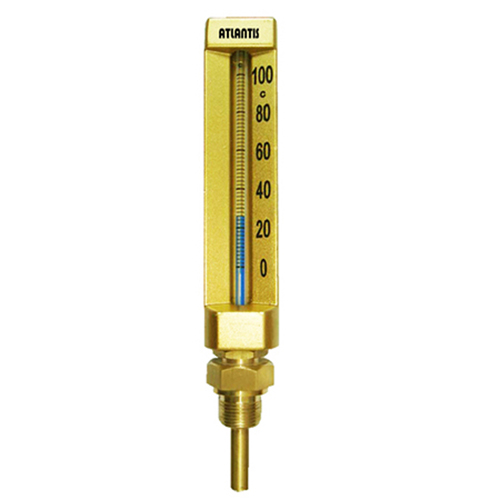
Locate an element on the screen. The height and width of the screenshot is (500, 500). thermometer is located at coordinates (239, 161).